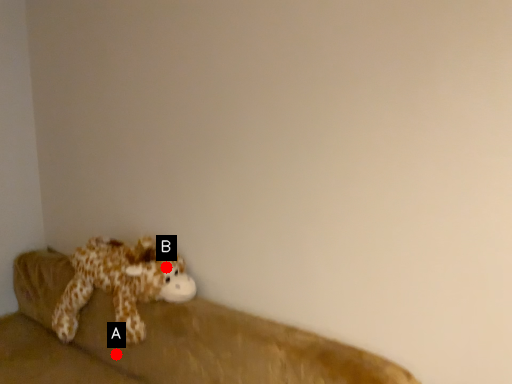
Question: Two points are circled on the image, labeled by A and B beside each circle. Which point appears farthest from the camera in this image?

Choices:
 (A) A is further
 (B) B is further

Answer: (A)